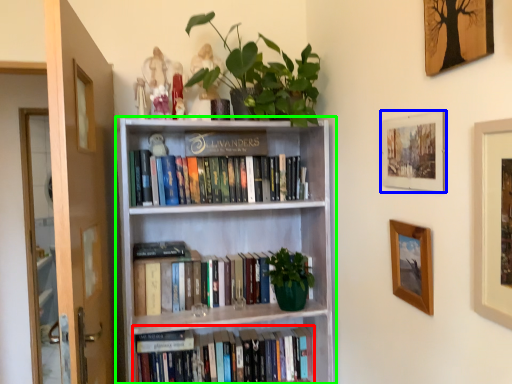
Question: Which is farther away from book (highlighted by a red box)? picture frame (highlighted by a blue box) or bookcase (highlighted by a green box)?

Choices:
 (A) picture frame
 (B) bookcase

Answer: (A)